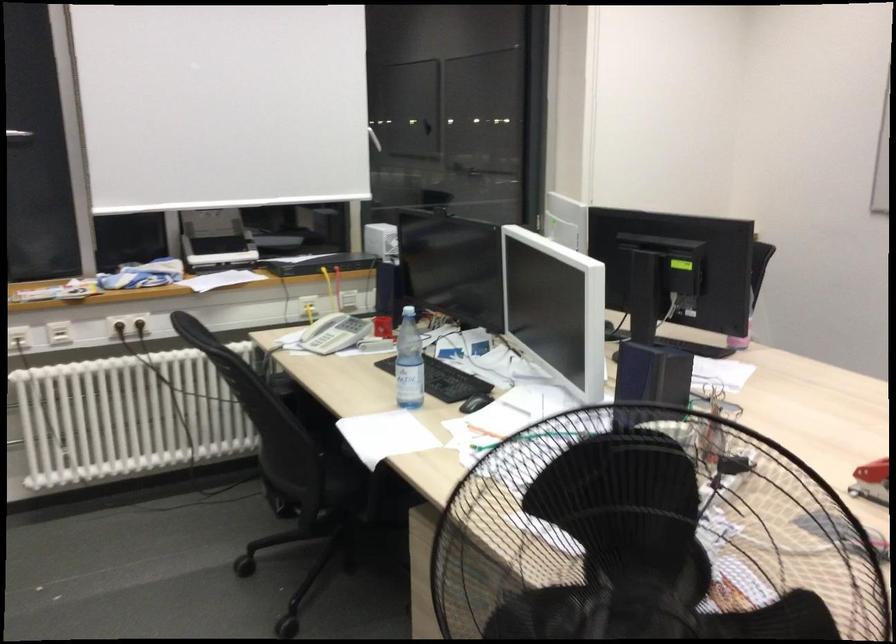
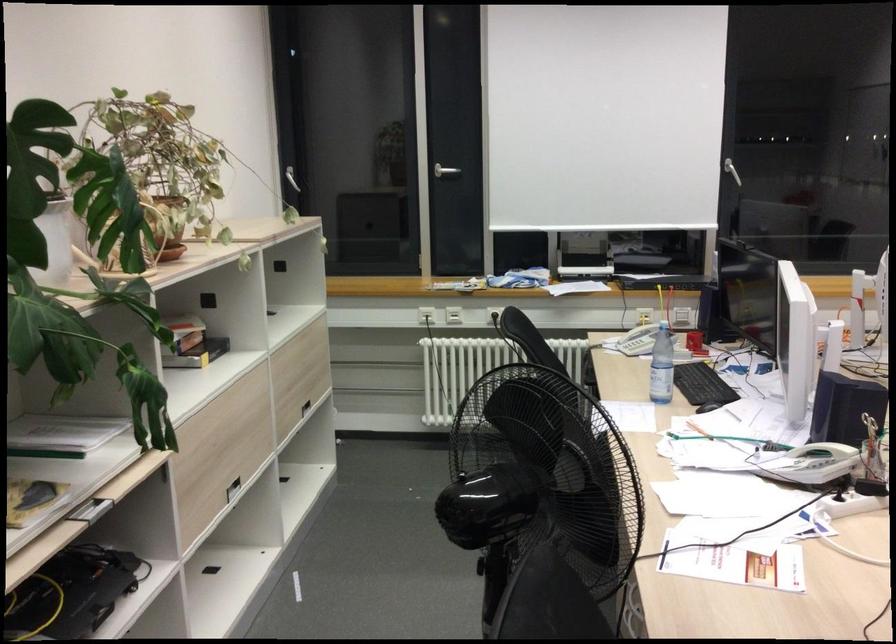
The point at (382, 324) is marked in the first image. Where is the corresponding point in the second image?

(694, 343)